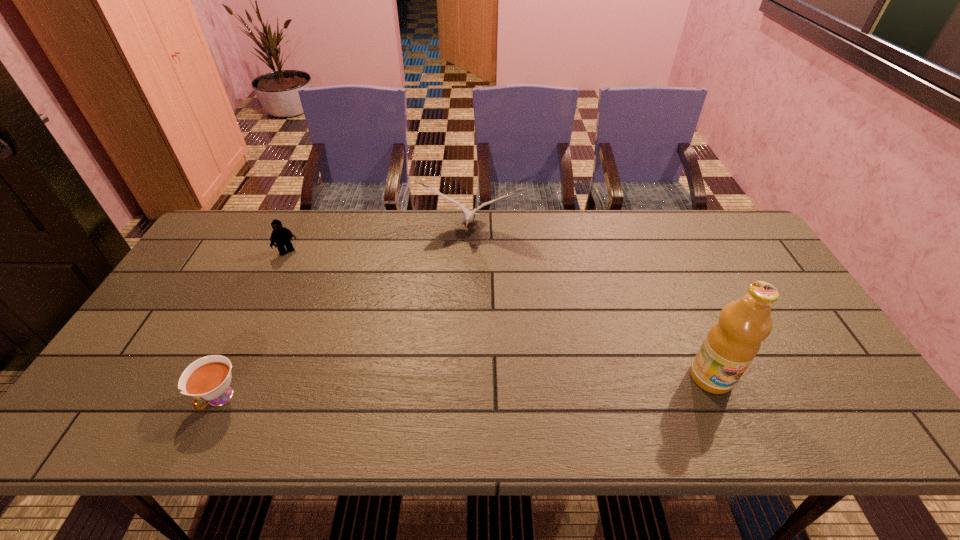
What are the coordinates of `vacant space on the desktop that is between the shortest object and the tallest object and is positioned at the tip of the beak of the third object from left to right` in the screenshot? It's located at (433, 390).

Locate an element on the screen. The image size is (960, 540). vacant space on the desktop that is between the teacup and the tallest object and is positioned on the face of the second shortest object is located at coordinates (404, 391).